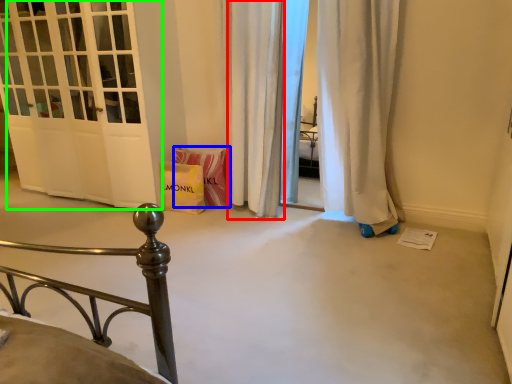
Question: Considering the real-world distances, which object is closest to curtain (highlighted by a red box)? material (highlighted by a blue box) or door (highlighted by a green box).

Choices:
 (A) material
 (B) door

Answer: (A)